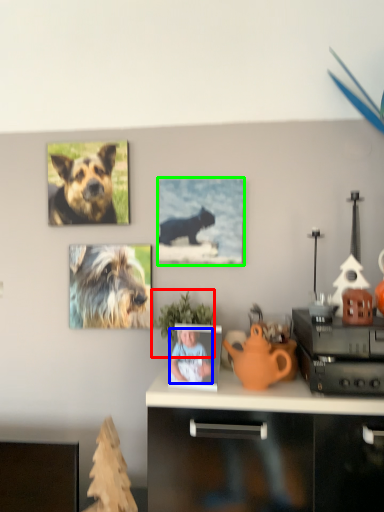
Question: Which is farther away from houseplant (highlighted by a red box)? person (highlighted by a blue box) or picture frame (highlighted by a green box)?

Choices:
 (A) person
 (B) picture frame

Answer: (B)